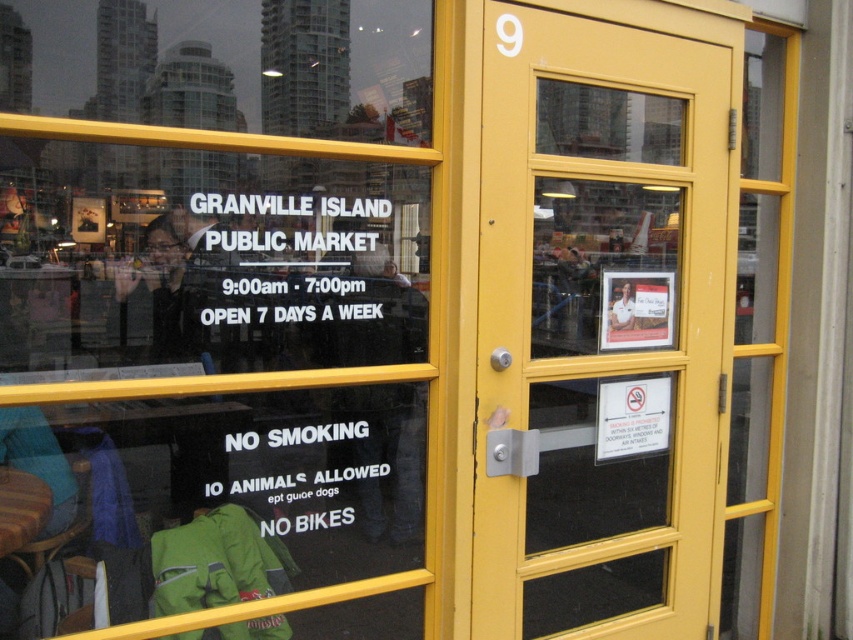
You are a delivery person needing to place a new sign on the door. The new sign must be placed between the existing white paper sign at lower center and the white paper sign at upper center. The new sign is 10 inches wide. Is there enough space between them to fit the new sign?

The distance between the white paper sign at lower center and the white paper sign at upper center is 21.22 inches. Since the new sign is 10 inches wide, there is sufficient space to place it between them.

You are standing in front of the Granville Island Public Market entrance. You want to enter the market but need to know if you can reach the yellow glass door at center from your current position. The maximum distance you can walk is 7 feet. Can you reach it?

The yellow glass door at center is 7.25 feet away from the camera. Since your maximum walking distance is 7 feet, you cannot reach the yellow glass door at center.

You are standing in front of the entrance to Granville Island Public Market. You see the yellow glass door at center and the white paper sign at upper center. Which object is located to the right of the other?

The yellow glass door at center is positioned on the right side of white paper sign at upper center.